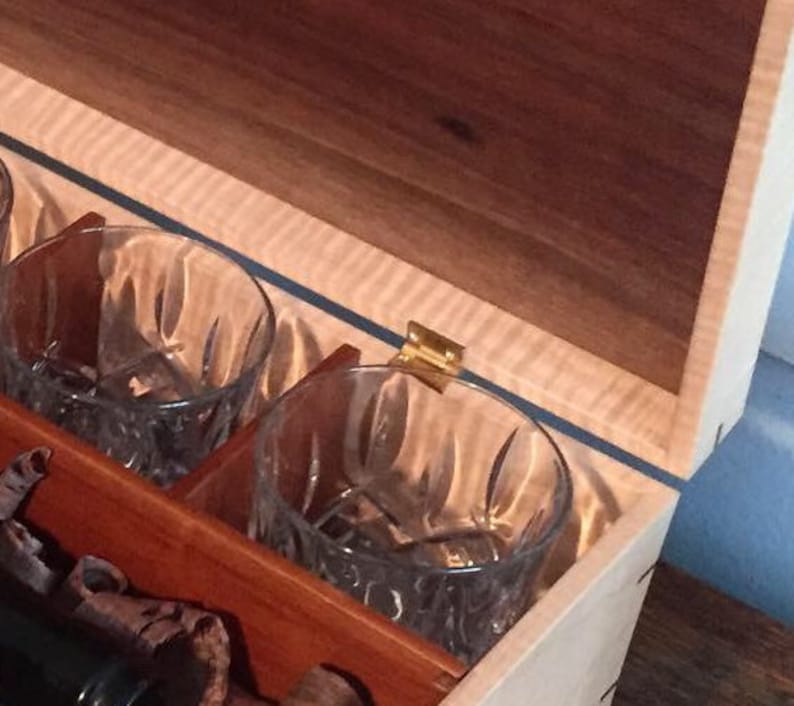
In order to click on separater in this screenshot , I will do `click(125, 538)`, `click(87, 219)`.